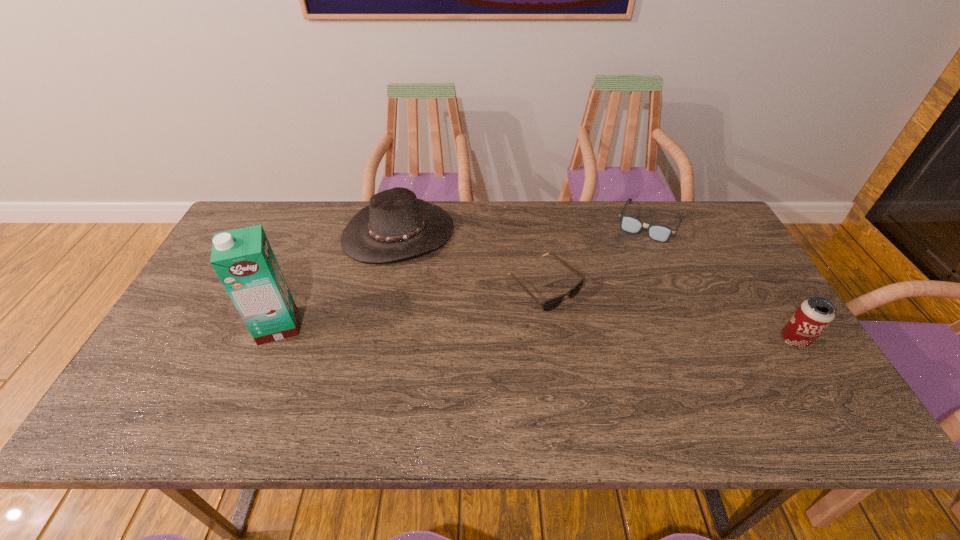
The image size is (960, 540). Identify the location of free space located on the front-facing side of the fourth object from right to left. (479, 354).

Image resolution: width=960 pixels, height=540 pixels. I want to click on vacant space located on the front-facing side of the fourth object from right to left, so click(x=485, y=363).

Locate an element on the screen. This screenshot has width=960, height=540. blank space located on the front-facing side of the fourth object from right to left is located at coordinates (465, 331).

The image size is (960, 540). Identify the location of free space located on the lenses of the sunglasses. (605, 338).

The height and width of the screenshot is (540, 960). What are the coordinates of `vacant space located on the lenses of the sunglasses` in the screenshot? It's located at (671, 395).

Where is `vacant space situated on the lenses of the sunglasses`? This screenshot has width=960, height=540. vacant space situated on the lenses of the sunglasses is located at coordinates (614, 346).

Where is `vacant space located on the face of the second object from right to left`? The image size is (960, 540). vacant space located on the face of the second object from right to left is located at coordinates (622, 280).

The height and width of the screenshot is (540, 960). Find the location of `vacant space located on the face of the second object from right to left`. vacant space located on the face of the second object from right to left is located at coordinates (632, 259).

At what (x,y) coordinates should I click in order to perform the action: click on vacant space located 0.070m on the face of the second object from right to left. Please return your answer as a coordinate pair (x, y). The image size is (960, 540). Looking at the image, I should click on (634, 255).

In order to click on hat situated at the far edge in this screenshot , I will do `click(395, 225)`.